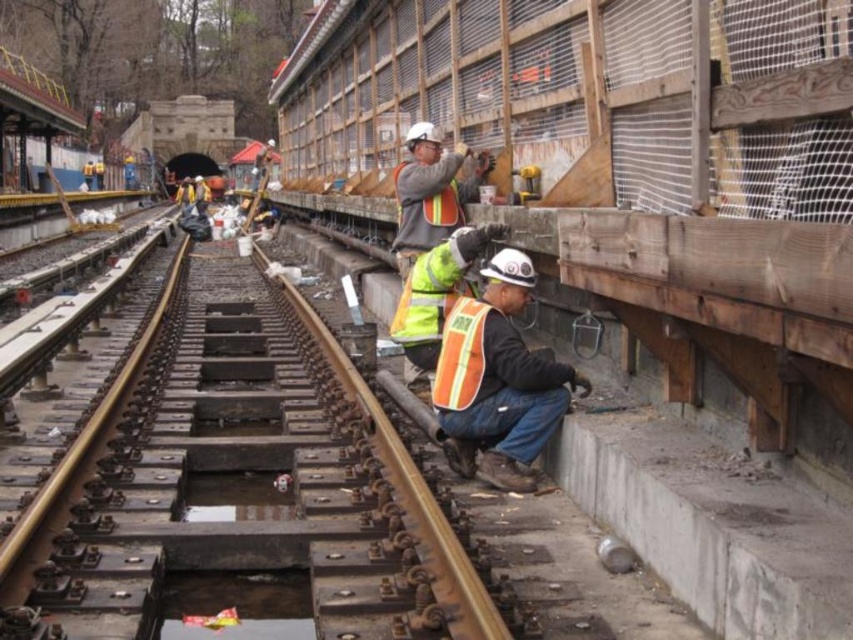
Does reflective orange safety vest at lower center appear on the left side of orange reflective safety vest at center?

In fact, reflective orange safety vest at lower center is to the right of orange reflective safety vest at center.

Can you confirm if reflective orange safety vest at lower center is shorter than orange reflective safety vest at center?

No.

Locate an element on the screen. The height and width of the screenshot is (640, 853). reflective orange safety vest at lower center is located at coordinates (460, 355).

Does rusty metal track at center have a greater width compared to reflective orange safety vest at lower center?

Correct, the width of rusty metal track at center exceeds that of reflective orange safety vest at lower center.

Does rusty metal track at center have a smaller size compared to reflective orange safety vest at lower center?

Incorrect, rusty metal track at center is not smaller in size than reflective orange safety vest at lower center.

Is point (285, 304) in front of point (462, 403)?

That is False.

Find the location of `rusty metal track at center`. rusty metal track at center is located at coordinates (265, 492).

Is orange reflective vest at lower center shorter than reflective orange safety vest at lower center?

No, orange reflective vest at lower center is not shorter than reflective orange safety vest at lower center.

Is orange reflective vest at lower center positioned before reflective orange safety vest at lower center?

Yes, orange reflective vest at lower center is in front of reflective orange safety vest at lower center.

The height and width of the screenshot is (640, 853). What do you see at coordinates (498, 380) in the screenshot? I see `orange reflective vest at lower center` at bounding box center [498, 380].

Locate an element on the screen. This screenshot has width=853, height=640. orange reflective vest at lower center is located at coordinates (498, 380).